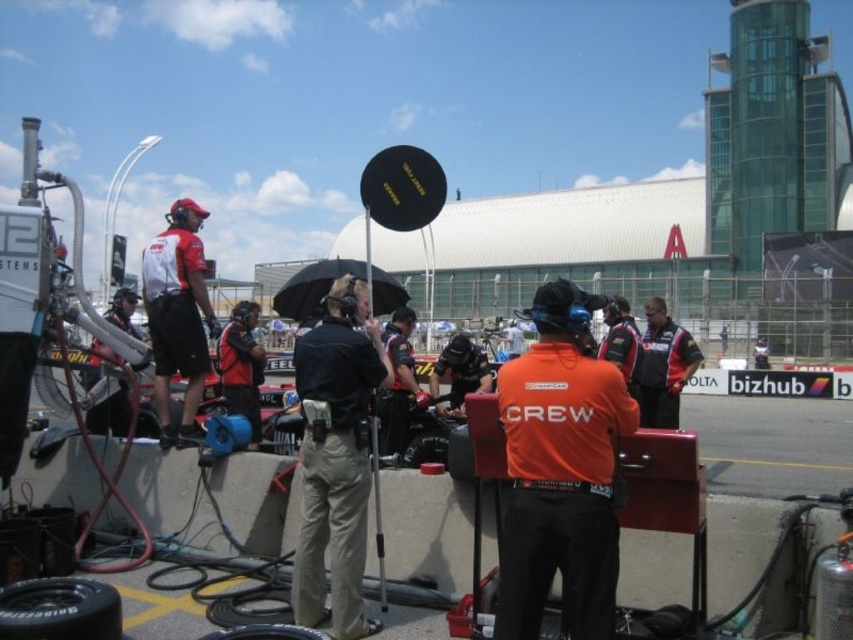
Question: Is black rubber tire at lower left thinner than black rubber tire at lower center?

Choices:
 (A) yes
 (B) no

Answer: (B)

Question: Is orange fabric shirt at center positioned in front of dark red uniform at center?

Choices:
 (A) no
 (B) yes

Answer: (B)

Question: Is matte red and white shirt at left to the right of black rubber tire at lower center from the viewer's perspective?

Choices:
 (A) no
 (B) yes

Answer: (A)

Question: Among these objects, which one is nearest to the camera?

Choices:
 (A) black rubber tire at lower left
 (B) black matte umbrella at center
 (C) black rubber tire at center
 (D) dark red uniform at center

Answer: (A)

Question: Among these objects, which one is nearest to the camera?

Choices:
 (A) black matte umbrella at center
 (B) dark red uniform at center
 (C) orange fabric shirt at center

Answer: (C)

Question: Which is nearer to the black rubber tire at lower center?

Choices:
 (A) matte red and white shirt at left
 (B) orange fabric shirt at center
 (C) black rubber tire at center

Answer: (B)